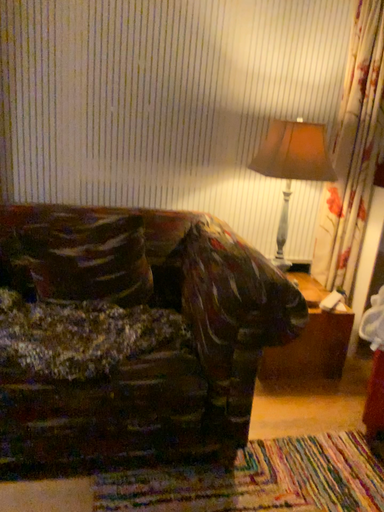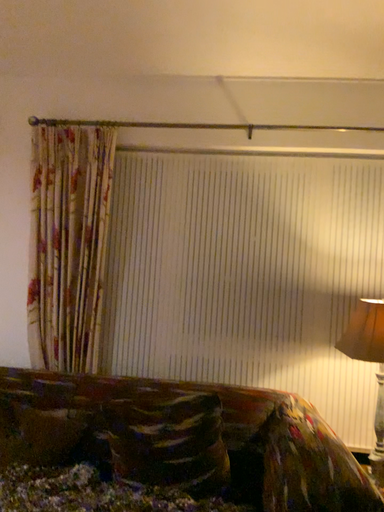
Question: Which way did the camera rotate in the video?

Choices:
 (A) rotated left
 (B) rotated right

Answer: (A)